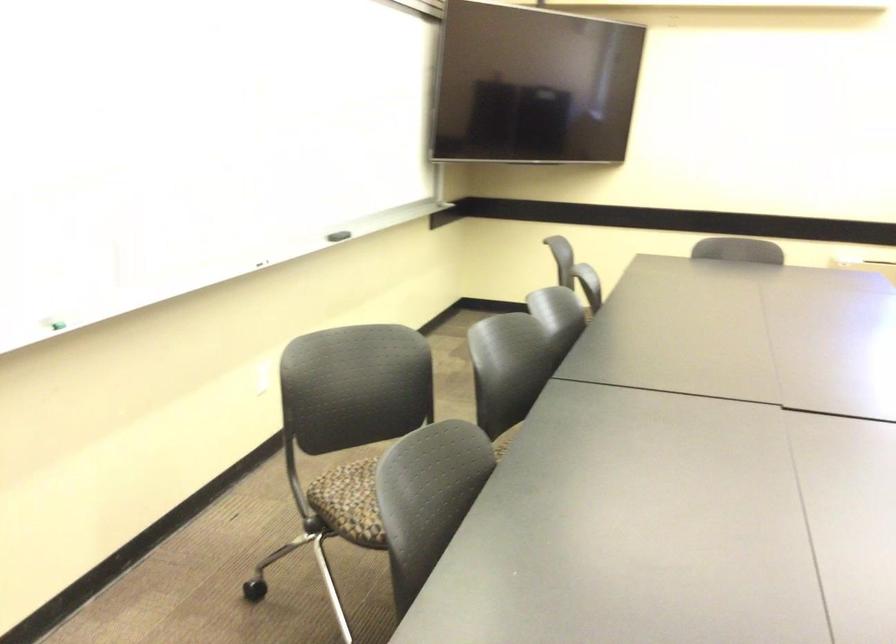
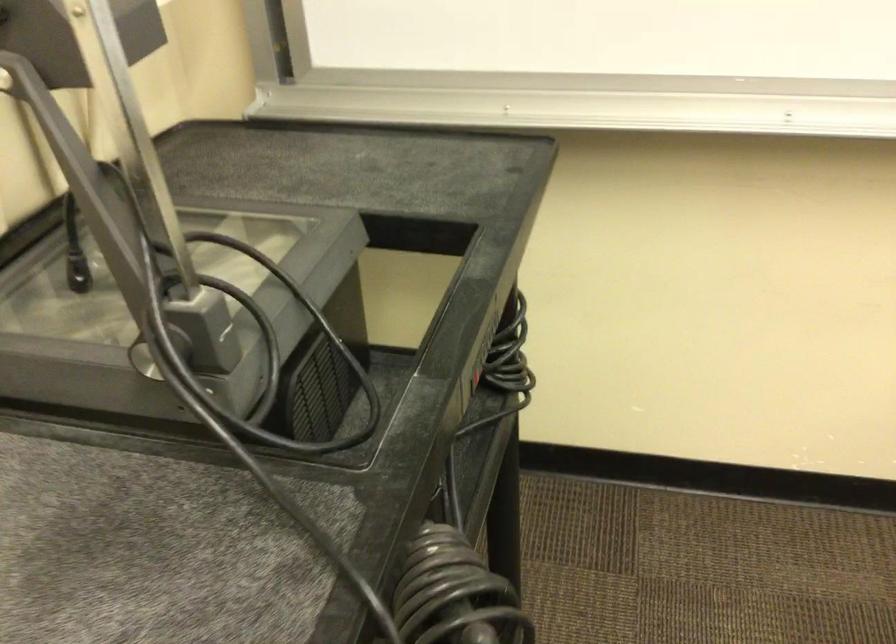
Based on the continuous images, in which direction is the camera rotating?

The camera's rotation is toward left-down.